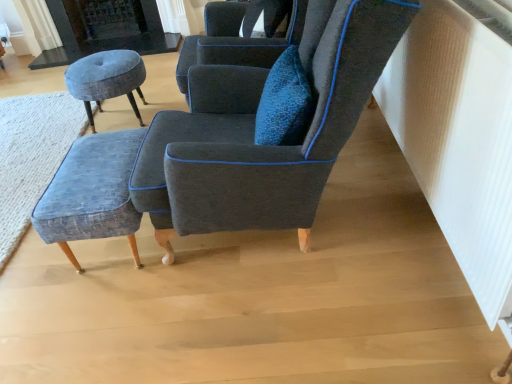
Identify the location of blank space situated above velvet blue stool at left, the second stool viewed from the front (from a real-world perspective). (101, 62).